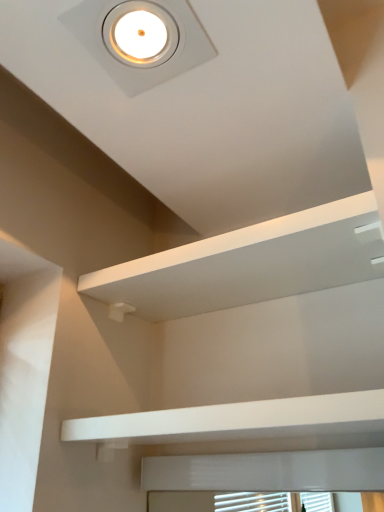
Question: In terms of size, does white matte/finish balustrade at lower center appear bigger or smaller than white matte shelf at upper center?

Choices:
 (A) small
 (B) big

Answer: (A)

Question: Is white matte/finish balustrade at lower center taller or shorter than white matte shelf at upper center?

Choices:
 (A) tall
 (B) short

Answer: (B)

Question: Considering the real-world distances, which object is closest to the white matte shelf at upper center?

Choices:
 (A) white matte/finish balustrade at lower center
 (B) white glossy droplight at upper center

Answer: (A)

Question: Which object is the farthest from the white glossy droplight at upper center?

Choices:
 (A) white matte/finish balustrade at lower center
 (B) white matte shelf at upper center

Answer: (A)